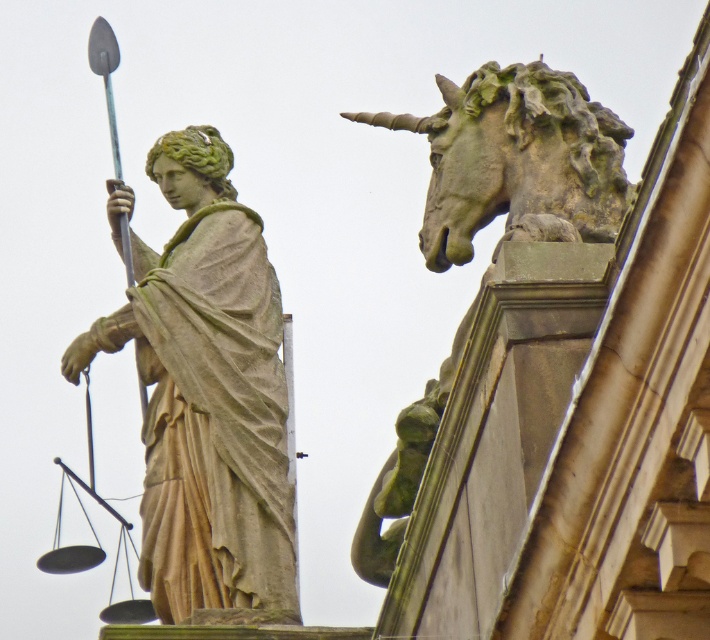
You are an architect inspecting the building facade and notice the matte stone statue at left and the stone unicorn head at upper right. Based on their positions, which object is positioned higher on the building?

The stone unicorn head at upper right is positioned higher on the building than the matte stone statue at left.

You are an architect reviewing a building design that includes the matte stone statue at left. The statue must be placed at coordinates between 0.6 and 0.3. Does its current position meet the design requirements?

The matte stone statue at left is positioned at point (207,394), which falls within the required coordinates between 0.6 and 0.3. Therefore, its current position meets the design requirements.

You are an architect assessing the structural integrity of the building. Given that the matte stone statue at left and the stone unicorn head at upper right are positioned on the building, which object might require more reinforcement due to its height?

The matte stone statue at left is taller than the stone unicorn head at upper right, so it might require more reinforcement due to its greater height.